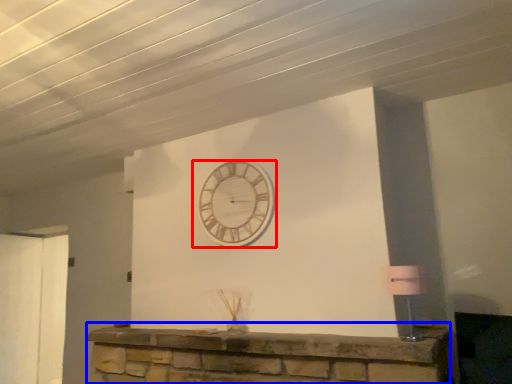
Question: Which of the following is the closest to the observer, wall clock (highlighted by a red box) or furniture (highlighted by a blue box)?

Choices:
 (A) wall clock
 (B) furniture

Answer: (B)